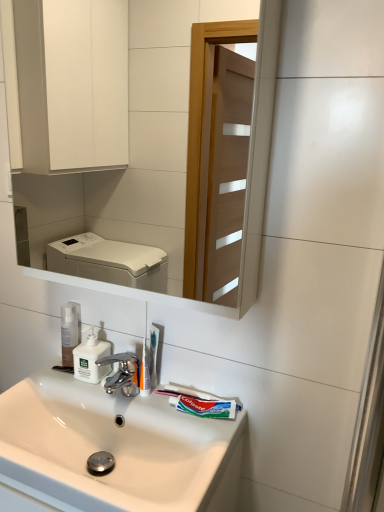
Find the location of a particular element. This screenshot has height=512, width=384. free space in front of white plastic toothbrush at center, which is the 1th toothbrush from front to back is located at coordinates (167, 421).